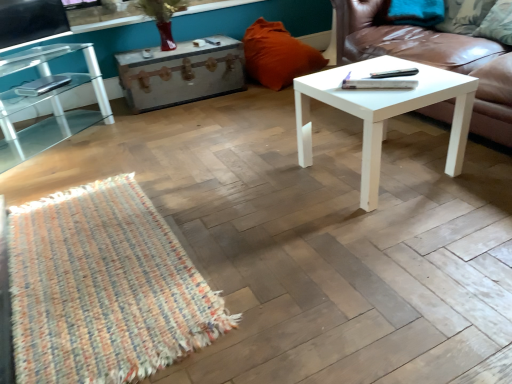
Where is `free location in front of orange fabric pillow at upper center, the first pillow when ordered from left to right`? The width and height of the screenshot is (512, 384). free location in front of orange fabric pillow at upper center, the first pillow when ordered from left to right is located at coordinates (251, 105).